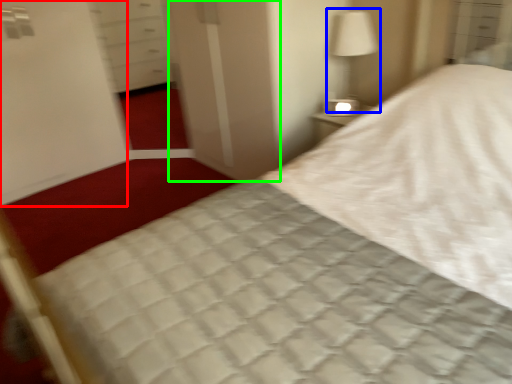
Question: Which object is positioned farthest from screen door (highlighted by a red box)? Select from bedside lamp (highlighted by a blue box) and screen door (highlighted by a green box).

Choices:
 (A) bedside lamp
 (B) screen door

Answer: (A)